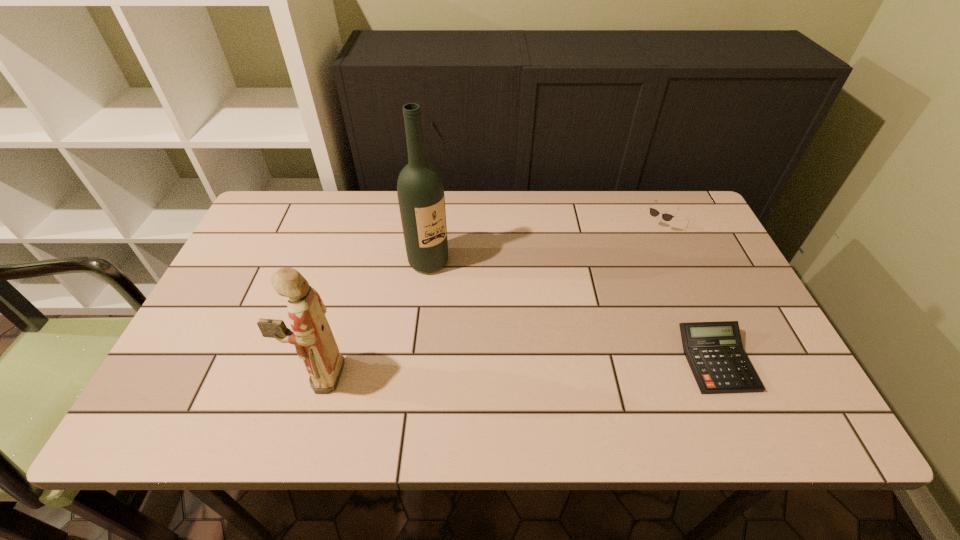
The height and width of the screenshot is (540, 960). I want to click on free space between the second tallest object and the shortest object, so (x=518, y=368).

Where is `free space between the third nearest object and the third shortest object`? The height and width of the screenshot is (540, 960). free space between the third nearest object and the third shortest object is located at coordinates (374, 318).

Locate an element on the screen. This screenshot has height=540, width=960. free space between the farthest object and the second farthest object is located at coordinates (540, 245).

Identify the location of free space between the farthest object and the leftmost object. (487, 301).

This screenshot has width=960, height=540. I want to click on free space between the sunglasses and the second farthest object, so click(x=540, y=245).

Locate an element on the screen. Image resolution: width=960 pixels, height=540 pixels. empty location between the figurine and the farthest object is located at coordinates (487, 301).

Where is `vacant point located between the third shortest object and the wine bottle`? vacant point located between the third shortest object and the wine bottle is located at coordinates (374, 318).

Find the location of a particular element. The height and width of the screenshot is (540, 960). empty location between the wine bottle and the farthest object is located at coordinates (540, 245).

Where is `free area in between the third nearest object and the farthest object`? The image size is (960, 540). free area in between the third nearest object and the farthest object is located at coordinates (540, 245).

Identify the location of free spot between the shortest object and the second shortest object. This screenshot has width=960, height=540. tap(684, 294).